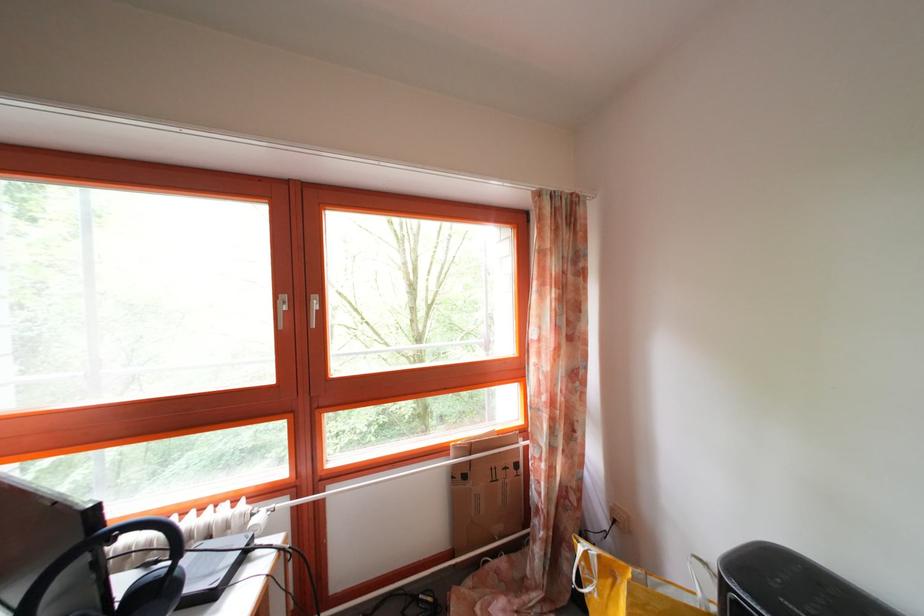
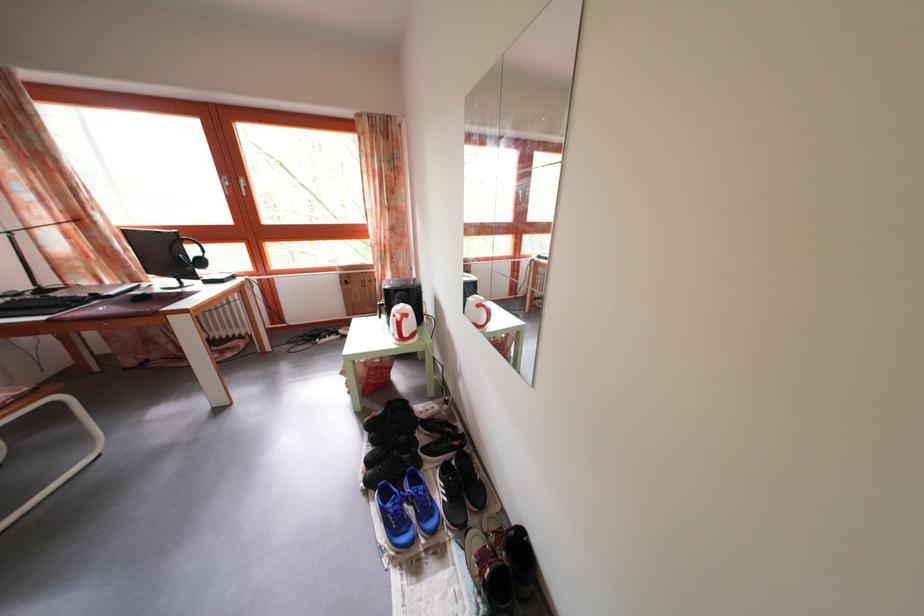
What movement of the cameraman would produce the second image?

The cameraman moved toward right, backward.